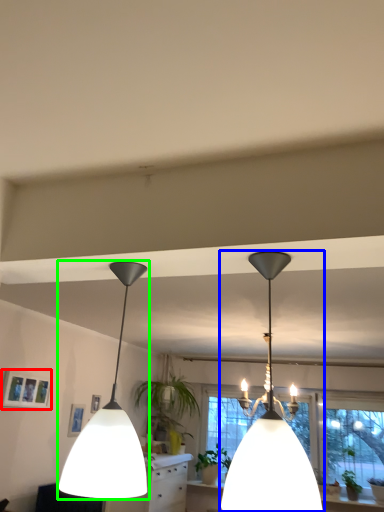
Question: Which is nearer to the picture frame (highlighted by a red box)? lamp (highlighted by a blue box) or lamp (highlighted by a green box).

Choices:
 (A) lamp
 (B) lamp

Answer: (B)